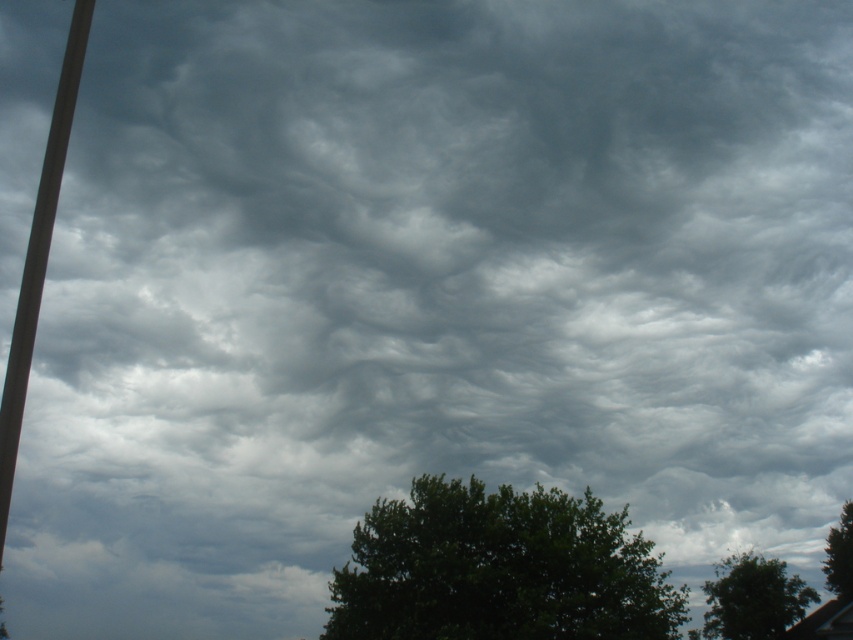
You are standing in a park and see the dark green leafy tree at center and the smooth gray pole at left. Which object is closer to your right side?

The dark green leafy tree at center is closer to your right side because it is positioned to the right of the smooth gray pole at left.

You are standing at the point marked by the coordinates [498,570] in the image. Looking around, you see a dark green leafy tree at center. Which direction should you face to look directly at the dark green leafy tree at center?

You are already at the point representing the dark green leafy tree at center, so you don not need to face any direction to look at it. You are standing at its location.

You are a painter standing in front of the scene. You want to paint the dark green leafy tree at center and the smooth gray pole at left. Which object should you use a smaller brush for?

The dark green leafy tree at center has a smaller width than the smooth gray pole at left, so you should use a smaller brush for the dark green leafy tree at center.